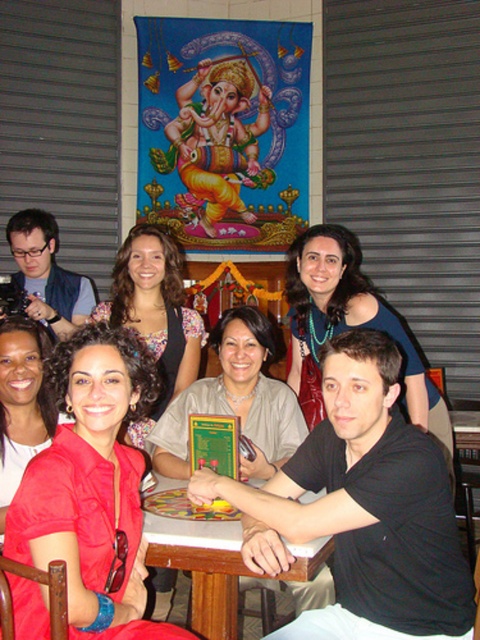
Question: Which point appears closest to the camera in this image?

Choices:
 (A) (28, 588)
 (B) (295, 360)

Answer: (A)

Question: Can you confirm if black matte shirt at center is thinner than white glossy table at center?

Choices:
 (A) yes
 (B) no

Answer: (B)

Question: Does black matte shirt at center appear over floral blouse at center?

Choices:
 (A) no
 (B) yes

Answer: (A)

Question: Can you confirm if black matte shirt at center is positioned to the right of red satin dress at lower left?

Choices:
 (A) yes
 (B) no

Answer: (A)

Question: Which point is closer to the camera?

Choices:
 (A) floral blouse at center
 (B) matte beige blouse at center
 (C) white glossy table at center
 (D) red satin dress at lower left

Answer: (D)

Question: Which object is farther from the camera taking this photo?

Choices:
 (A) red satin dress at lower left
 (B) blue fabric dress at center
 (C) floral blouse at center

Answer: (C)